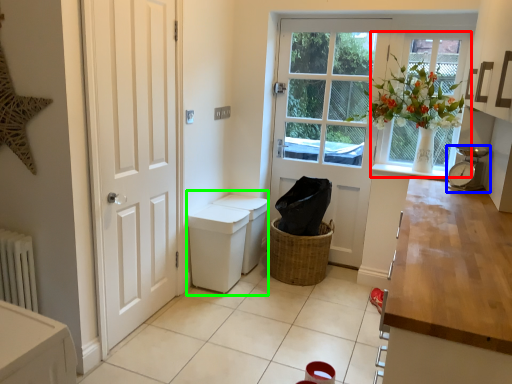
Question: Based on their relative distances, which object is farther from window (highlighted by a red box)? Choose from alarm clock (highlighted by a blue box) and sink (highlighted by a green box).

Choices:
 (A) alarm clock
 (B) sink

Answer: (B)